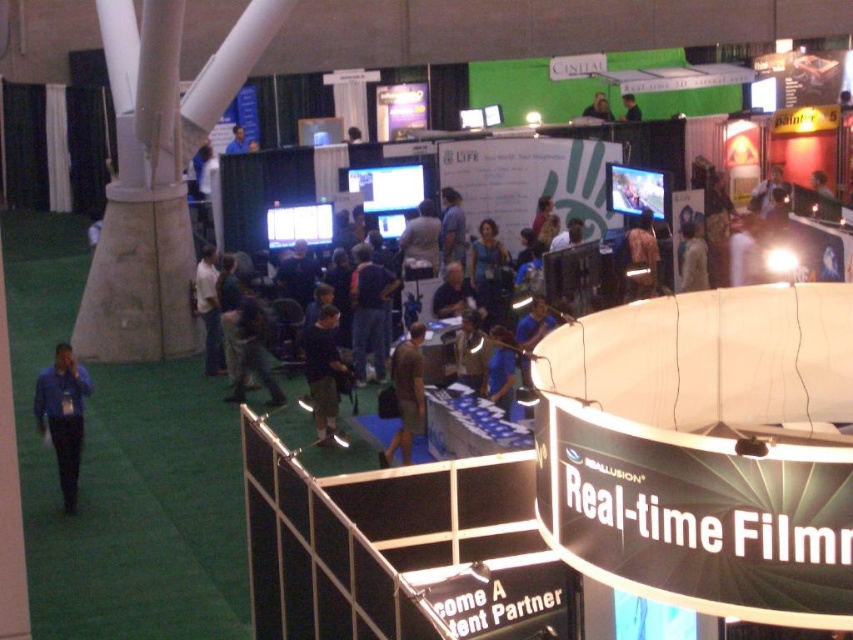
Question: Estimate the real-world distances between objects in this image. Which object is farther from the brown fabric shirt at center?

Choices:
 (A) blue shirt at left
 (B) blue shirt at center
 (C) light brown leather jacket at center

Answer: (A)

Question: Can you confirm if light brown leather jacket at center is positioned to the left of blue shirt at center?

Choices:
 (A) yes
 (B) no

Answer: (A)

Question: Is blue shirt at center to the right of dark blue shirt at upper center from the viewer's perspective?

Choices:
 (A) yes
 (B) no

Answer: (B)

Question: Which point is closer to the camera?

Choices:
 (A) blue shirt at left
 (B) khaki shorts at center
 (C) dark blue shirt at center
 (D) brown fabric shirt at center

Answer: (A)

Question: Does khaki shorts at center have a lesser width compared to brown fabric shirt at center?

Choices:
 (A) yes
 (B) no

Answer: (B)

Question: Based on their relative distances, which object is nearer to the light brown leather jacket at center?

Choices:
 (A) brown fabric shirt at center
 (B) blue shirt at center
 (C) dark blue shirt at center

Answer: (C)